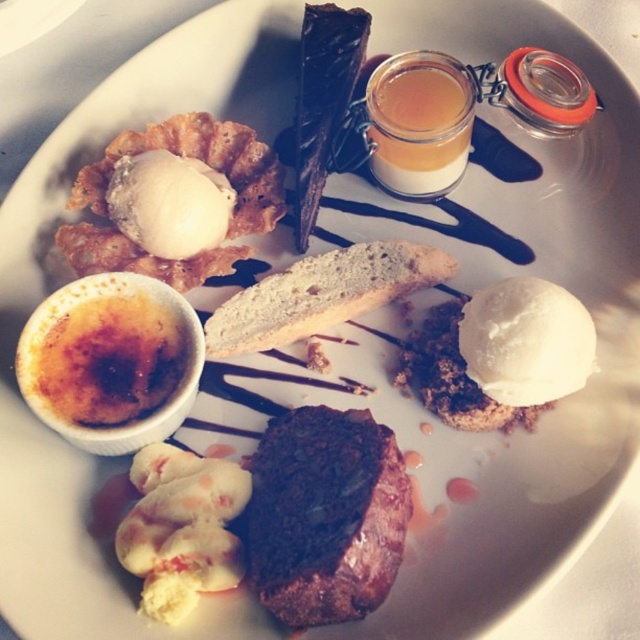
Who is taller, white crumbly biscotti at center or white creamy ice cream at upper left?

white creamy ice cream at upper left is taller.

Is point (390, 241) behind point (260, 192)?

No, it is not.

This screenshot has width=640, height=640. Describe the element at coordinates (321, 294) in the screenshot. I see `white crumbly biscotti at center` at that location.

Where is `white crumbly biscotti at center`? The image size is (640, 640). white crumbly biscotti at center is located at coordinates (321, 294).

Is dark chocolate cake at center wider than white creamy ice cream at upper left?

No.

Consider the image. Can you confirm if dark chocolate cake at center is positioned to the right of white creamy ice cream at upper left?

Yes, dark chocolate cake at center is to the right of white creamy ice cream at upper left.

Is point (273, 488) closer to camera compared to point (280, 164)?

That is True.

Locate an element on the screen. The image size is (640, 640). dark chocolate cake at center is located at coordinates (324, 515).

Who is lower down, white creamy ice cream at upper left or dark chocolate bar at upper center?

Positioned lower is white creamy ice cream at upper left.

Does white creamy ice cream at upper left have a greater width compared to dark chocolate bar at upper center?

Indeed, white creamy ice cream at upper left has a greater width compared to dark chocolate bar at upper center.

The image size is (640, 640). Identify the location of white creamy ice cream at upper left. (196, 157).